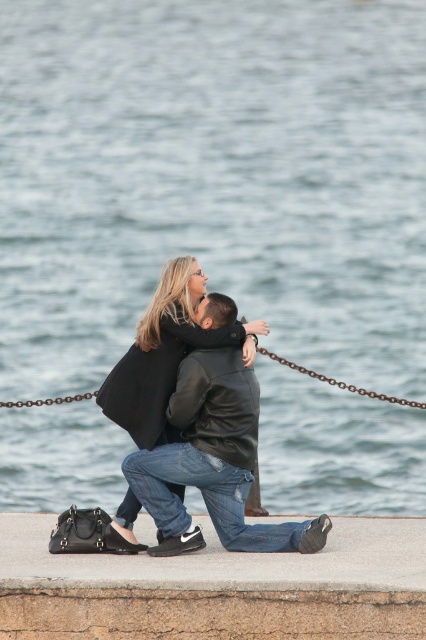
You are a photographer trying to capture the couple in the scene. You want to ensure that both the concrete at lower center and the black leather jacket at center are clearly visible in your shot. Given their sizes, which object should you focus on first to ensure it is in frame?

The concrete at lower center has a larger size compared to the black leather jacket at center, so you should focus on the concrete at lower center first to ensure it is in frame.

You are a photographer standing at the edge of the waterfront scene. You want to place a small decorative stone on the concrete at lower center so that it is level with the top of the black leather jacket at center. Is this possible?

The concrete at lower center has a greater height compared to the black leather jacket at center. Therefore, placing the stone on the concrete at lower center would make it higher than the jacket, so it won

In the scene shown: You are a photographer standing at the waterfront scene. You want to capture a photo where the concrete at lower center and the black leather jacket at center are both visible. Which object will appear larger in the photo?

The concrete at lower center will appear larger in the photo because it is closer to the viewer than the black leather jacket at center.